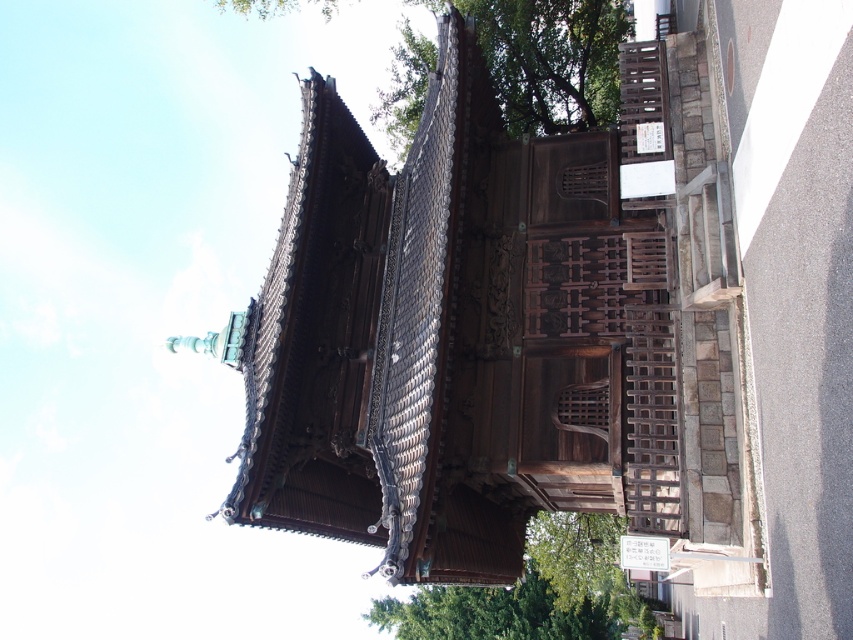
Question: Is green leafy tree at upper center to the left of green leafy tree at lower center from the viewer's perspective?

Choices:
 (A) no
 (B) yes

Answer: (B)

Question: Which object appears closest to the camera in this image?

Choices:
 (A) green leafy tree at lower center
 (B) green leafy tree at upper center

Answer: (A)

Question: Which point is closer to the camera?

Choices:
 (A) green leafy tree at lower left
 (B) green leafy tree at upper center

Answer: (A)

Question: Considering the relative positions of green leafy tree at upper center and green leafy tree at lower center in the image provided, where is green leafy tree at upper center located with respect to green leafy tree at lower center?

Choices:
 (A) left
 (B) right

Answer: (A)

Question: Does green leafy tree at lower left lie in front of green leafy tree at lower center?

Choices:
 (A) yes
 (B) no

Answer: (B)

Question: Which object is positioned farthest from the green leafy tree at upper center?

Choices:
 (A) green leafy tree at lower left
 (B) green leafy tree at lower center

Answer: (B)